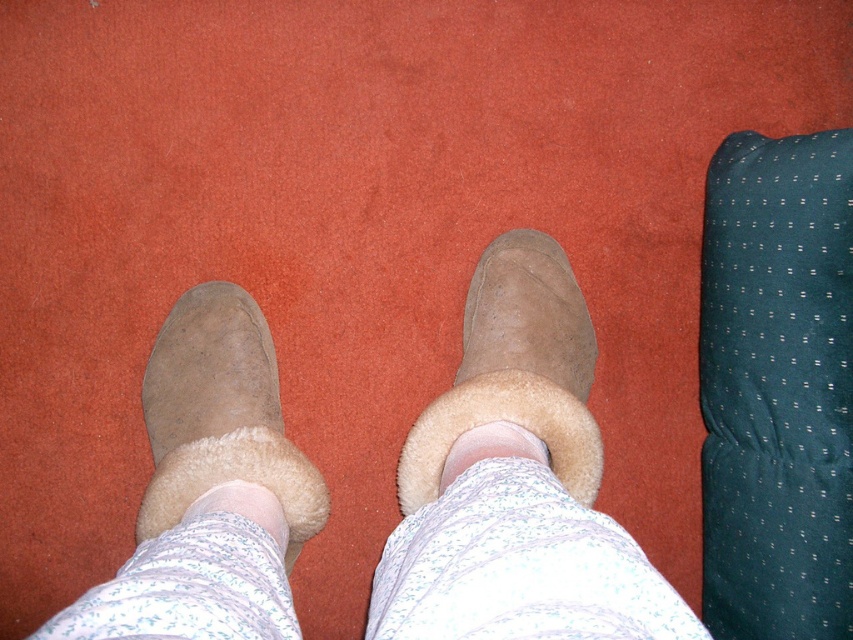
Does suede/sheepskin boot at lower left lie in front of white fluffy ankle at center?

No, suede/sheepskin boot at lower left is further to the viewer.

What do you see at coordinates (219, 416) in the screenshot?
I see `suede/sheepskin boot at lower left` at bounding box center [219, 416].

At what (x,y) coordinates should I click in order to perform the action: click on suede/sheepskin boot at lower left. Please return your answer as a coordinate pair (x, y). This screenshot has width=853, height=640. Looking at the image, I should click on (219, 416).

Is white fluffy sock at center taller than white fluffy ankle at center?

No, white fluffy sock at center is not taller than white fluffy ankle at center.

Can you confirm if white fluffy sock at center is thinner than white fluffy ankle at center?

Incorrect, white fluffy sock at center's width is not less than white fluffy ankle at center's.

Does point (492, 432) lie behind point (259, 502)?

Yes.

Where is `white fluffy sock at center`? white fluffy sock at center is located at coordinates [490, 449].

Consider the image. How far apart are suede/sheepskin boot at center and white fluffy sock at center?

They are 4.23 inches apart.

Can you confirm if suede/sheepskin boot at center is positioned to the right of white fluffy sock at center?

Indeed, suede/sheepskin boot at center is positioned on the right side of white fluffy sock at center.

What do you see at coordinates (515, 369) in the screenshot? I see `suede/sheepskin boot at center` at bounding box center [515, 369].

Where is `suede/sheepskin boot at center`? The width and height of the screenshot is (853, 640). suede/sheepskin boot at center is located at coordinates (515, 369).